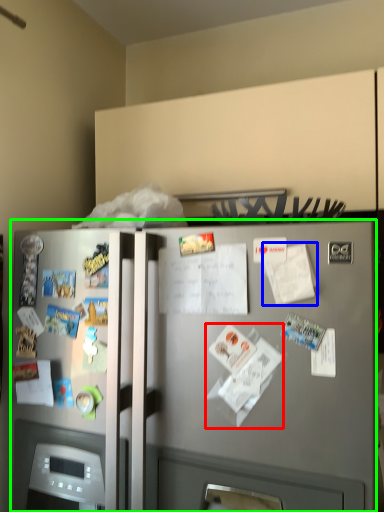
Question: Which object is the farthest from paper (highlighted by a red box)? Choose among these: paper (highlighted by a blue box) or refrigerator (highlighted by a green box).

Choices:
 (A) paper
 (B) refrigerator

Answer: (B)